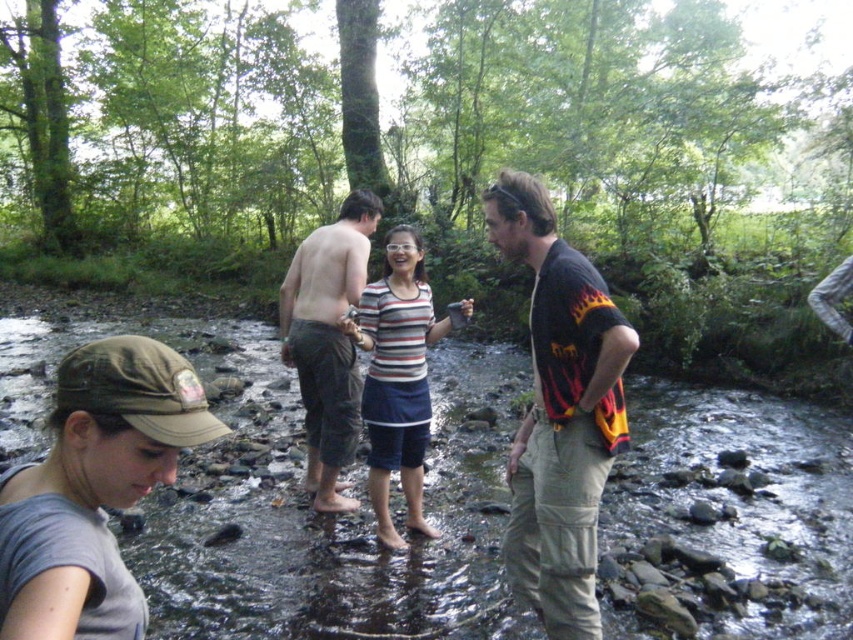
Does black cotton shirt at center have a greater width compared to green cotton shorts at center?

Incorrect, black cotton shirt at center's width does not surpass green cotton shorts at center's.

Who is more distant from viewer, (587, 417) or (325, 476)?

The point (325, 476) is behind.

Where is `black cotton shirt at center`? This screenshot has height=640, width=853. black cotton shirt at center is located at coordinates (560, 412).

Locate an element on the screen. The width and height of the screenshot is (853, 640). clear water at creek center is located at coordinates (300, 500).

Looking at this image, does clear water at creek center come in front of green cotton shorts at center?

Yes, it is.

Is point (697, 435) positioned in front of point (349, 394)?

No, (697, 435) is further to viewer.

This screenshot has width=853, height=640. I want to click on clear water at creek center, so click(300, 500).

Can you confirm if gray matte cap at lower left is positioned to the right of black cotton shirt at center?

No, gray matte cap at lower left is not to the right of black cotton shirt at center.

Who is taller, gray matte cap at lower left or black cotton shirt at center?

Standing taller between the two is black cotton shirt at center.

The width and height of the screenshot is (853, 640). Identify the location of gray matte cap at lower left. (94, 488).

Where is `gray matte cap at lower left`? gray matte cap at lower left is located at coordinates (94, 488).